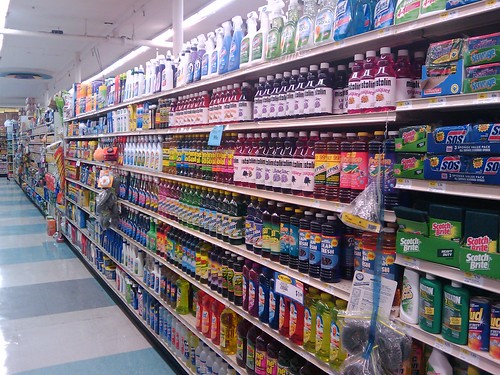
You are a GUI agent. You are given a task and a screenshot of the screen. Output one action in this format:
    pyautogui.click(x=<x>, y=<y>)
    Task: Click on the blue sponges
    This screenshot has width=500, height=375.
    Given the screenshot: What is the action you would take?
    pyautogui.click(x=484, y=138), pyautogui.click(x=484, y=156), pyautogui.click(x=462, y=167), pyautogui.click(x=455, y=142)